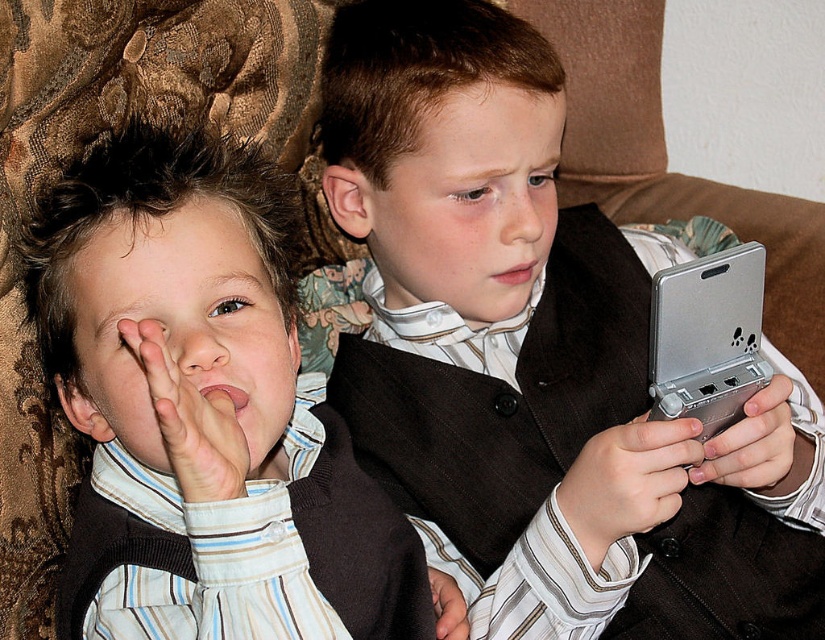
Question: Which object appears farthest from the camera in this image?

Choices:
 (A) silver metallic game console at right
 (B) matte brown vest at left
 (C) metallic silver controller at right
 (D) silver metallic handheld device at right

Answer: (C)

Question: Which object is farther from the camera taking this photo?

Choices:
 (A) silver metallic game console at right
 (B) silver metallic handheld device at right
 (C) matte brown vest at right

Answer: (C)

Question: Does matte brown vest at left appear on the right side of matte brown vest at right?

Choices:
 (A) yes
 (B) no

Answer: (B)

Question: Is matte black vest at center below silver metallic game console at right?

Choices:
 (A) yes
 (B) no

Answer: (B)

Question: From the image, what is the correct spatial relationship of matte black vest at center in relation to silver metallic handheld device at right?

Choices:
 (A) right
 (B) left

Answer: (B)

Question: Estimate the real-world distances between objects in this image. Which object is closer to the matte black vest at center?

Choices:
 (A) metallic silver controller at right
 (B) silver metallic game console at right
 (C) matte brown vest at left
 (D) matte brown vest at right

Answer: (B)